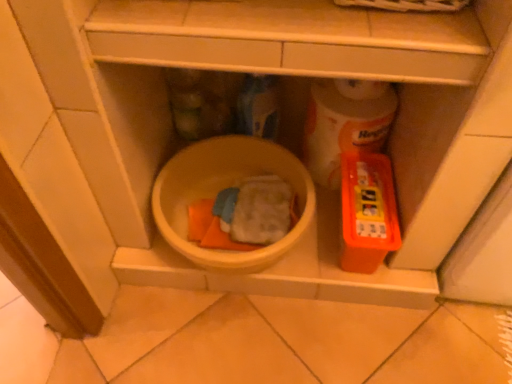
Question: Does orange plastic container at right appear on the right side of white glossy toilet paper at center right?

Choices:
 (A) no
 (B) yes

Answer: (B)

Question: Is white glossy toilet paper at center right located within orange plastic container at right?

Choices:
 (A) no
 (B) yes

Answer: (B)

Question: From a real-world perspective, is orange plastic container at right physically below white glossy toilet paper at center right?

Choices:
 (A) yes
 (B) no

Answer: (A)

Question: From the image's perspective, does orange plastic container at right appear lower than white glossy toilet paper at center right?

Choices:
 (A) no
 (B) yes

Answer: (B)

Question: Are orange plastic container at right and white glossy toilet paper at center right far apart?

Choices:
 (A) no
 (B) yes

Answer: (A)

Question: From the image's perspective, is yellow matte mixing bowl at center above or below orange plastic container at right?

Choices:
 (A) below
 (B) above

Answer: (B)

Question: In the image, is yellow matte mixing bowl at center on the left side or the right side of orange plastic container at right?

Choices:
 (A) right
 (B) left

Answer: (B)

Question: Is yellow matte mixing bowl at center situated inside orange plastic container at right or outside?

Choices:
 (A) outside
 (B) inside

Answer: (A)

Question: Is yellow matte mixing bowl at center wider or thinner than orange plastic container at right?

Choices:
 (A) wide
 (B) thin

Answer: (A)

Question: Is white glossy toilet paper at center right inside the boundaries of yellow matte mixing bowl at center, or outside?

Choices:
 (A) outside
 (B) inside

Answer: (A)

Question: Considering the positions of white glossy toilet paper at center right and yellow matte mixing bowl at center in the image, is white glossy toilet paper at center right taller or shorter than yellow matte mixing bowl at center?

Choices:
 (A) tall
 (B) short

Answer: (A)

Question: From a real-world perspective, is white glossy toilet paper at center right physically located above or below yellow matte mixing bowl at center?

Choices:
 (A) above
 (B) below

Answer: (A)

Question: From the image's perspective, is white glossy toilet paper at center right above or below yellow matte mixing bowl at center?

Choices:
 (A) below
 (B) above

Answer: (B)

Question: Based on their sizes in the image, would you say white glossy toilet paper at center right is bigger or smaller than orange plastic container at right?

Choices:
 (A) small
 (B) big

Answer: (A)

Question: Considering the positions of white glossy toilet paper at center right and orange plastic container at right in the image, is white glossy toilet paper at center right taller or shorter than orange plastic container at right?

Choices:
 (A) tall
 (B) short

Answer: (A)